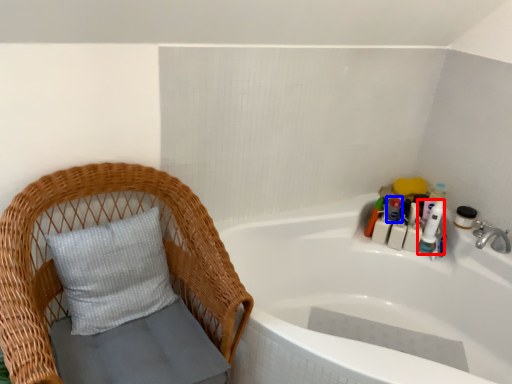
Question: Which object is closer to the camera taking this photo, toiletry (highlighted by a red box) or toiletry (highlighted by a blue box)?

Choices:
 (A) toiletry
 (B) toiletry

Answer: (A)